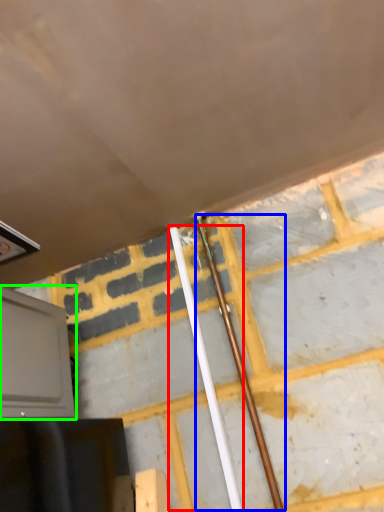
Question: Which is farther away from beam (highlighted by a red box)? beam (highlighted by a blue box) or oven (highlighted by a green box)?

Choices:
 (A) beam
 (B) oven

Answer: (B)